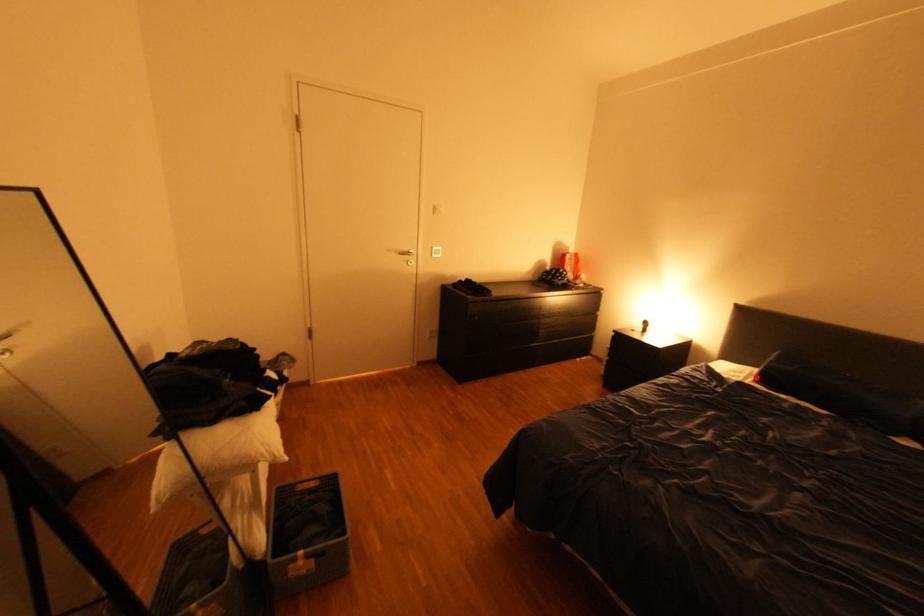
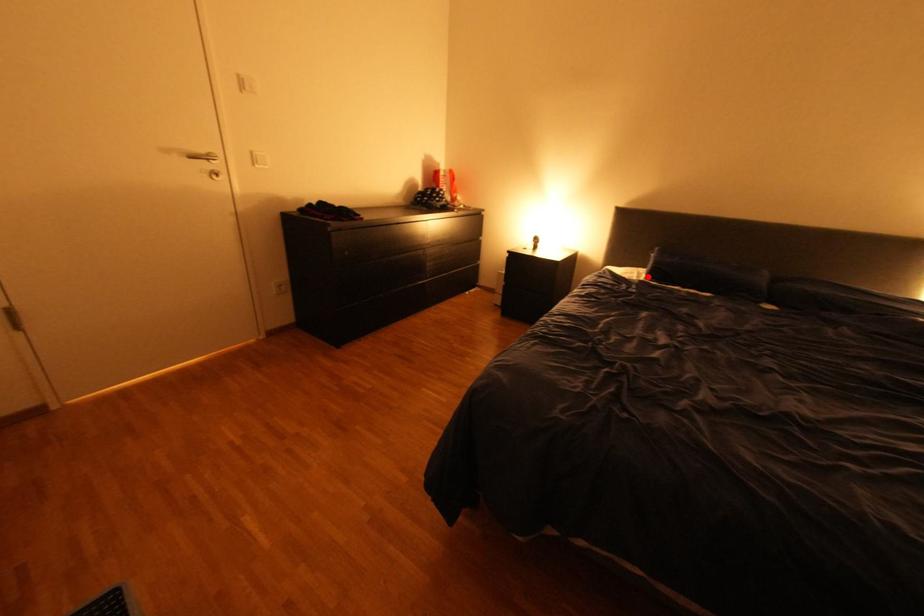
I am providing you with two images of the same scene from different viewpoints. A red point is marked on the first image and another point is marked on the second image. Is the red point in image1 aligned with the point shown in image2?

Yes